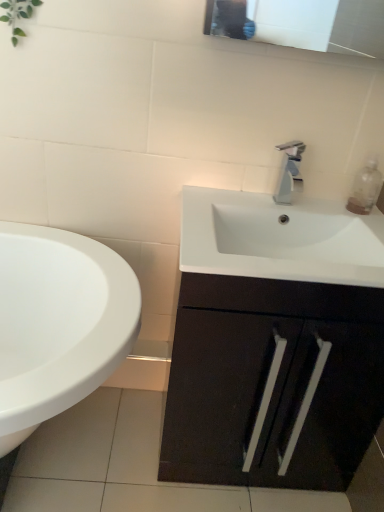
Question: Is silver metallic faucet at center turned away from white glossy sink at lower left?

Choices:
 (A) yes
 (B) no

Answer: (B)

Question: Can you confirm if silver metallic faucet at center is taller than white glossy sink at lower left?

Choices:
 (A) yes
 (B) no

Answer: (B)

Question: Is silver metallic faucet at center positioned beyond the bounds of white glossy sink at lower left?

Choices:
 (A) yes
 (B) no

Answer: (A)

Question: Considering the relative sizes of silver metallic faucet at center and white glossy sink at lower left in the image provided, is silver metallic faucet at center wider than white glossy sink at lower left?

Choices:
 (A) yes
 (B) no

Answer: (B)

Question: Is silver metallic faucet at center shorter than white glossy sink at lower left?

Choices:
 (A) yes
 (B) no

Answer: (A)

Question: Is white glossy sink at lower left spatially inside matte black cabinet at center, or outside of it?

Choices:
 (A) outside
 (B) inside

Answer: (A)

Question: Based on their sizes in the image, would you say white glossy sink at lower left is bigger or smaller than matte black cabinet at center?

Choices:
 (A) big
 (B) small

Answer: (A)

Question: Is white glossy sink at lower left taller or shorter than matte black cabinet at center?

Choices:
 (A) short
 (B) tall

Answer: (A)

Question: From the image's perspective, is white glossy sink at lower left above or below matte black cabinet at center?

Choices:
 (A) below
 (B) above

Answer: (A)

Question: Considering the positions of clear plastic bottle at upper right and silver metallic faucet at center in the image, is clear plastic bottle at upper right taller or shorter than silver metallic faucet at center?

Choices:
 (A) tall
 (B) short

Answer: (B)

Question: Is clear plastic bottle at upper right inside the boundaries of silver metallic faucet at center, or outside?

Choices:
 (A) outside
 (B) inside

Answer: (A)

Question: From a real-world perspective, is clear plastic bottle at upper right physically located above or below silver metallic faucet at center?

Choices:
 (A) below
 (B) above

Answer: (A)

Question: Considering their positions, is clear plastic bottle at upper right located in front of or behind silver metallic faucet at center?

Choices:
 (A) front
 (B) behind

Answer: (B)

Question: Based on their positions, is matte black cabinet at center located to the left or right of white glossy sink at lower left?

Choices:
 (A) right
 (B) left

Answer: (A)

Question: Based on their sizes in the image, would you say matte black cabinet at center is bigger or smaller than white glossy sink at lower left?

Choices:
 (A) small
 (B) big

Answer: (A)